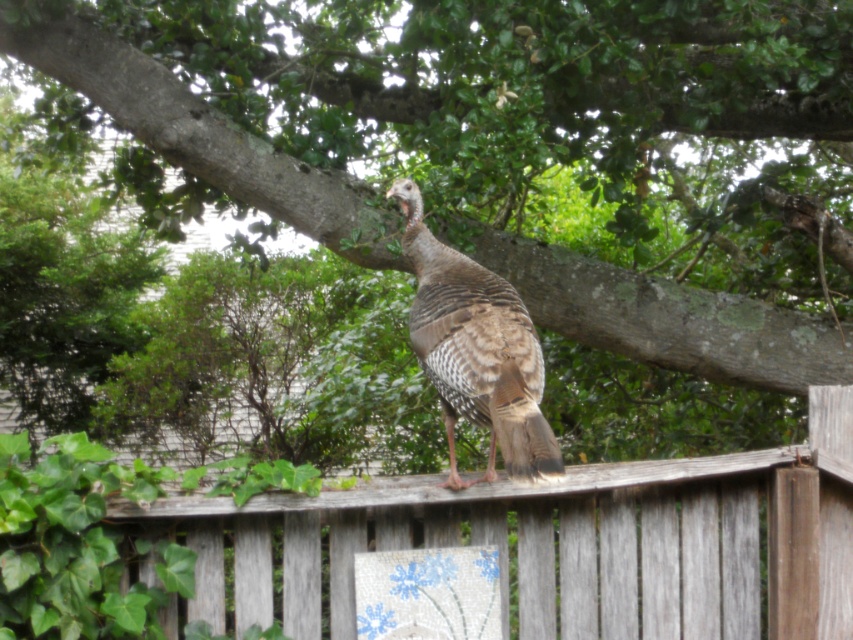
Does weathered wood fence at upper center have a lesser width compared to brown speckled feathers at center?

In fact, weathered wood fence at upper center might be wider than brown speckled feathers at center.

Between point (611, 611) and point (515, 372), which one is positioned behind?

Point (611, 611)

What are the coordinates of `weathered wood fence at upper center` in the screenshot? It's located at (554, 545).